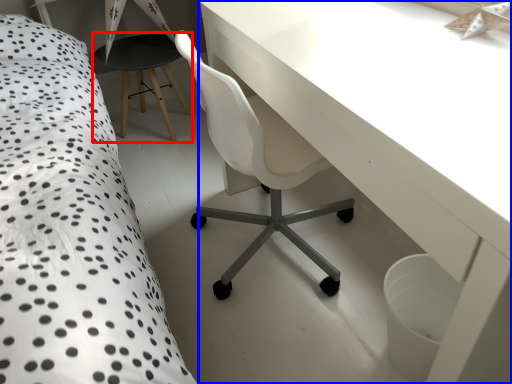
Question: Which object appears farthest to the camera in this image, bar stool (highlighted by a red box) or table (highlighted by a blue box)?

Choices:
 (A) bar stool
 (B) table

Answer: (A)